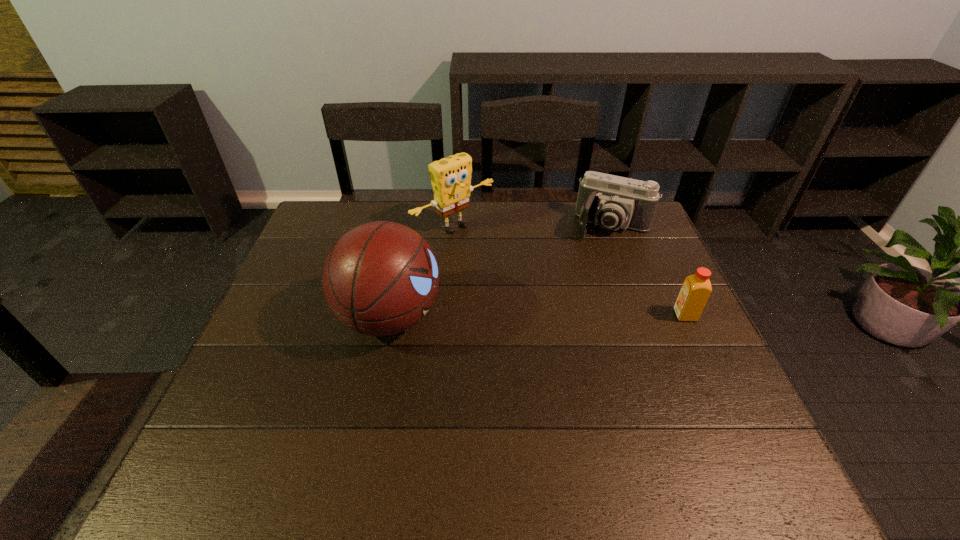
Find the location of a particular element. The height and width of the screenshot is (540, 960). basketball is located at coordinates click(380, 278).

This screenshot has height=540, width=960. Find the location of `orange juice`. orange juice is located at coordinates (696, 289).

The image size is (960, 540). Find the location of `sponge`. sponge is located at coordinates (450, 177).

The height and width of the screenshot is (540, 960). Identify the location of camera. (613, 202).

Locate an element on the screen. This screenshot has height=540, width=960. vacant space located 0.180m on the right of the basketball is located at coordinates (511, 317).

I want to click on blank space located 0.360m on the front and back of the orange juice, so click(538, 315).

The width and height of the screenshot is (960, 540). I want to click on blank area located 0.070m on the front and back of the orange juice, so click(x=648, y=315).

In order to click on free space located 0.250m on the front and back of the orange juice in this screenshot , I will do `click(579, 315)`.

Locate an element on the screen. vacant space located on the face of the sponge is located at coordinates (x=543, y=292).

Locate an element on the screen. The image size is (960, 540). free location located 0.290m on the face of the sponge is located at coordinates (543, 292).